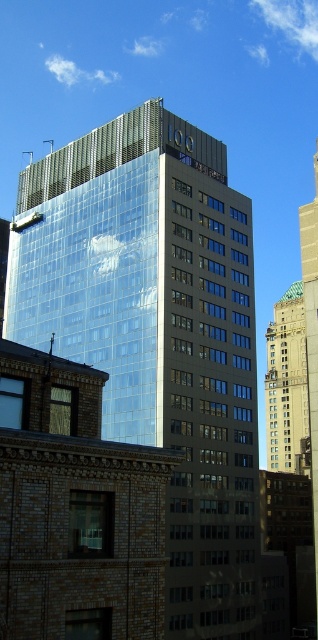
Question: Where is glassy reflective building at center located in relation to gold metallic bell tower at upper right in the image?

Choices:
 (A) above
 (B) below

Answer: (A)

Question: Which point appears closest to the camera in this image?

Choices:
 (A) (125, 390)
 (B) (296, 387)

Answer: (A)

Question: Can you confirm if glassy reflective building at center is smaller than gold metallic bell tower at upper right?

Choices:
 (A) no
 (B) yes

Answer: (A)

Question: Which point is farther to the camera?

Choices:
 (A) (277, 356)
 (B) (163, 340)

Answer: (A)

Question: Does glassy reflective building at center appear under gold metallic bell tower at upper right?

Choices:
 (A) no
 (B) yes

Answer: (A)